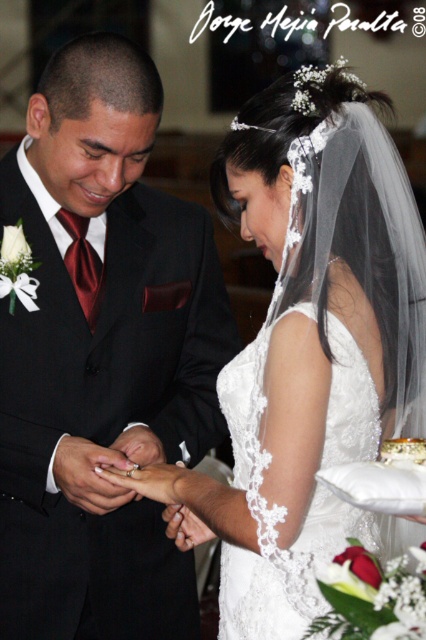
Which is more to the right, matte black suit at center or lace fabric wedding dress at center?

Positioned to the right is lace fabric wedding dress at center.

Is matte black suit at center taller than lace fabric wedding dress at center?

Yes, matte black suit at center is taller than lace fabric wedding dress at center.

Is point (43, 145) less distant than point (328, 497)?

No, it is not.

Find the location of a particular element. The height and width of the screenshot is (640, 426). matte black suit at center is located at coordinates (101, 356).

Does white textured cake at center lie in front of silver metallic ring at center?

Yes, it is.

From the picture: Can you confirm if white textured cake at center is positioned above silver metallic ring at center?

Yes.

What do you see at coordinates (403, 451) in the screenshot? I see `white textured cake at center` at bounding box center [403, 451].

Locate an element on the screen. This screenshot has height=640, width=426. white textured cake at center is located at coordinates (403, 451).

Can you confirm if white lace dress at center is positioned to the left of silver metallic ring at center?

Incorrect, white lace dress at center is not on the left side of silver metallic ring at center.

Where is `white lace dress at center`? The height and width of the screenshot is (640, 426). white lace dress at center is located at coordinates (307, 348).